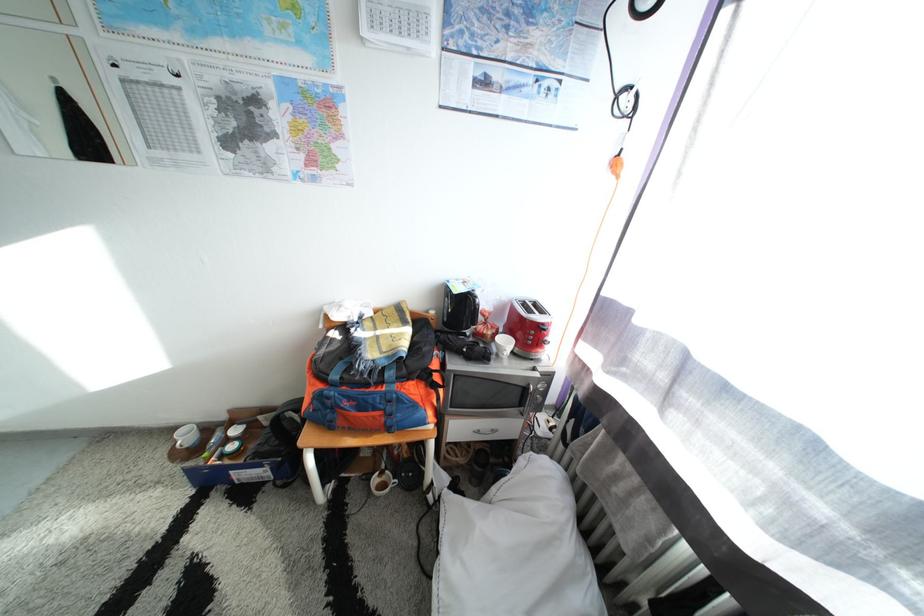
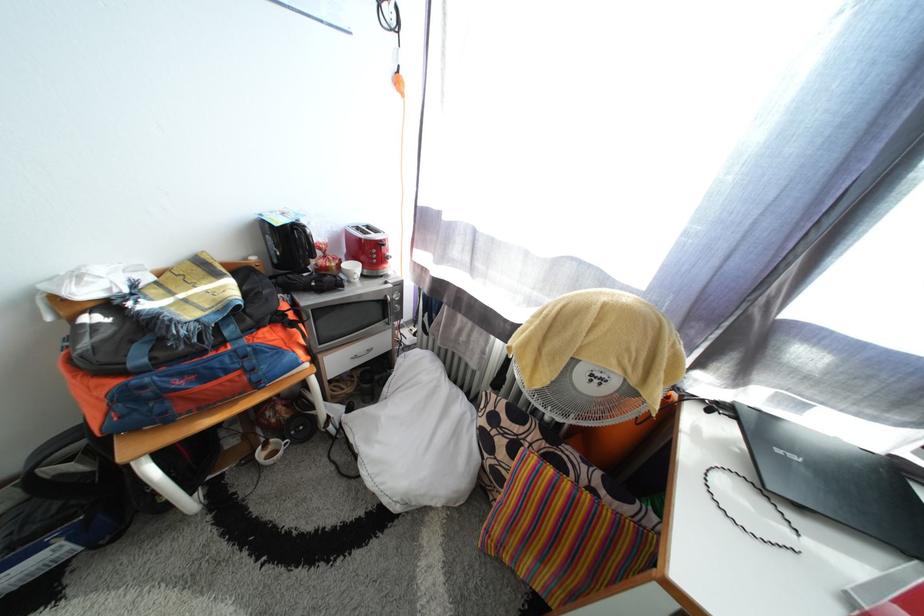
The point at (485, 435) is marked in the first image. Where is the corresponding point in the second image?

(361, 361)